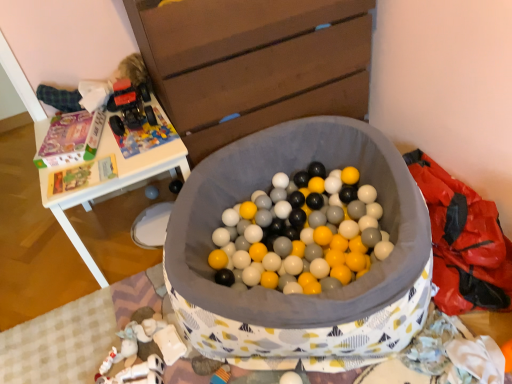
What do you see at coordinates (253, 63) in the screenshot? I see `wooden chest of drawers at upper center` at bounding box center [253, 63].

Image resolution: width=512 pixels, height=384 pixels. What are the coordinates of `wooden chest of drawers at upper center` in the screenshot? It's located at tap(253, 63).

What do you see at coordinates (112, 185) in the screenshot? This screenshot has width=512, height=384. I see `white plastic table at upper left` at bounding box center [112, 185].

Looking at this image, in order to face white plastic table at upper left, should I rotate leftwards or rightwards?

Rotate left and turn 17.139 degrees.

You are a GUI agent. You are given a task and a screenshot of the screen. Output one action in this format:
    pyautogui.click(x=<x>, y=<y>)
    Task: Click on the white plastic table at upper left
    This screenshot has width=512, height=384.
    Given the screenshot: What is the action you would take?
    pyautogui.click(x=112, y=185)

This screenshot has height=384, width=512. I want to click on wooden chest of drawers at upper center, so click(253, 63).

Considering the relative positions of white plastic table at upper left and wooden chest of drawers at upper center in the image provided, is white plastic table at upper left to the right of wooden chest of drawers at upper center from the viewer's perspective?

In fact, white plastic table at upper left is to the left of wooden chest of drawers at upper center.

Is white plastic table at upper left positioned before wooden chest of drawers at upper center?

No, the depth of white plastic table at upper left is greater than that of wooden chest of drawers at upper center.

Which is in front, point (39, 129) or point (332, 107)?

Point (332, 107)

From the image's perspective, relative to wooden chest of drawers at upper center, is white plastic table at upper left above or below?

white plastic table at upper left is below wooden chest of drawers at upper center.

Based on the photo, from a real-world perspective, between white plastic table at upper left and wooden chest of drawers at upper center, who is vertically higher?

In real-world perspective, wooden chest of drawers at upper center is above.

Which of these two, white plastic table at upper left or wooden chest of drawers at upper center, is thinner?

wooden chest of drawers at upper center.

Can you confirm if white plastic table at upper left is shorter than wooden chest of drawers at upper center?

Yes, white plastic table at upper left is shorter than wooden chest of drawers at upper center.

Can you confirm if white plastic table at upper left is smaller than wooden chest of drawers at upper center?

Yes, white plastic table at upper left is smaller than wooden chest of drawers at upper center.

Is wooden chest of drawers at upper center inside white plastic table at upper left?

No, wooden chest of drawers at upper center is not surrounded by white plastic table at upper left.

Would you consider white plastic table at upper left to be distant from wooden chest of drawers at upper center?

Actually, white plastic table at upper left and wooden chest of drawers at upper center are a little close together.

Is wooden chest of drawers at upper center at the back of white plastic table at upper left?

No, wooden chest of drawers at upper center is not at the back of white plastic table at upper left.

Measure the distance from white plastic table at upper left to wooden chest of drawers at upper center.

white plastic table at upper left is 16.54 inches away from wooden chest of drawers at upper center.

Identify the location of table on the left of wooden chest of drawers at upper center. (112, 185).

Considering the positions of objects wooden chest of drawers at upper center and white plastic table at upper left in the image provided, who is more to the left, wooden chest of drawers at upper center or white plastic table at upper left?

From the viewer's perspective, white plastic table at upper left appears more on the left side.

Which object is more forward, wooden chest of drawers at upper center or white plastic table at upper left?

wooden chest of drawers at upper center is more forward.

Between point (225, 72) and point (187, 161), which one is positioned behind?

Point (187, 161)

From the image's perspective, is wooden chest of drawers at upper center located above white plastic table at upper left?

Yes, from the image's perspective, wooden chest of drawers at upper center is over white plastic table at upper left.

From a real-world perspective, which is physically below, wooden chest of drawers at upper center or white plastic table at upper left?

white plastic table at upper left is physically lower.

In terms of width, does wooden chest of drawers at upper center look wider or thinner when compared to white plastic table at upper left?

wooden chest of drawers at upper center is thinner than white plastic table at upper left.

Is wooden chest of drawers at upper center taller than white plastic table at upper left?

Indeed, wooden chest of drawers at upper center has a greater height compared to white plastic table at upper left.

Who is bigger, wooden chest of drawers at upper center or white plastic table at upper left?

wooden chest of drawers at upper center.

Is wooden chest of drawers at upper center not within white plastic table at upper left?

Yes, wooden chest of drawers at upper center is outside of white plastic table at upper left.

Would you say wooden chest of drawers at upper center is a long distance from white plastic table at upper left?

No, wooden chest of drawers at upper center is not far away from white plastic table at upper left.

Does wooden chest of drawers at upper center turn towards white plastic table at upper left?

No, wooden chest of drawers at upper center is not aimed at white plastic table at upper left.

Can you tell me how much wooden chest of drawers at upper center and white plastic table at upper left differ in facing direction?

There is a 1.02-degree angle between the facing directions of wooden chest of drawers at upper center and white plastic table at upper left.

How much distance is there between wooden chest of drawers at upper center and white plastic table at upper left?

16.54 inches.

Where is `the chest of drawers above the white plastic table at upper left (from the image's perspective)`? The width and height of the screenshot is (512, 384). the chest of drawers above the white plastic table at upper left (from the image's perspective) is located at coordinates (253, 63).

You are a GUI agent. You are given a task and a screenshot of the screen. Output one action in this format:
    pyautogui.click(x=<x>, y=<y>)
    Task: Click on the chest of drawers in front of the white plastic table at upper left
    
    Given the screenshot: What is the action you would take?
    pyautogui.click(x=253, y=63)

Identify the location of chest of drawers above the white plastic table at upper left (from the image's perspective). This screenshot has width=512, height=384. (253, 63).